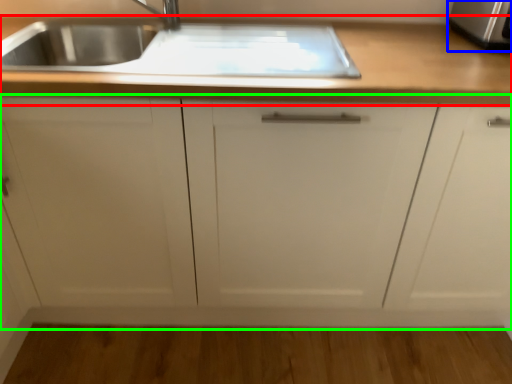
Question: Which is farther away from countertop (highlighted by a red box)? stainless steel (highlighted by a blue box) or cabinetry (highlighted by a green box)?

Choices:
 (A) stainless steel
 (B) cabinetry

Answer: (A)